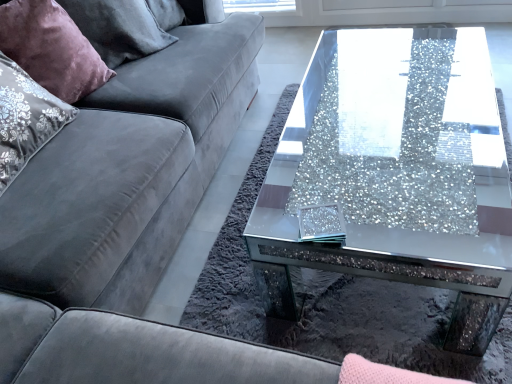
What are the coordinates of `velvet grey couch at left` in the screenshot? It's located at (129, 171).

What is the approximate height of sparkly glass coffee table at center?

sparkly glass coffee table at center is 15.68 inches tall.

Describe the element at coordinates (51, 48) in the screenshot. I see `velvet purple pillow at upper left` at that location.

What are the coordinates of `velvet grey couch at left` in the screenshot? It's located at (129, 171).

Visually, is velvet grey couch at left positioned to the left or to the right of velvet purple pillow at upper left?

From the image, it's evident that velvet grey couch at left is to the right of velvet purple pillow at upper left.

From a real-world perspective, which is physically below, velvet grey couch at left or velvet purple pillow at upper left?

velvet grey couch at left.

Considering the relative sizes of velvet grey couch at left and velvet purple pillow at upper left in the image provided, is velvet grey couch at left smaller than velvet purple pillow at upper left?

No, velvet grey couch at left is not smaller than velvet purple pillow at upper left.

Does velvet grey couch at left have a lesser width compared to velvet purple pillow at upper left?

Incorrect, the width of velvet grey couch at left is not less than that of velvet purple pillow at upper left.

Measure the distance from velvet grey couch at left to sparkly glass coffee table at center.

A distance of 21.33 inches exists between velvet grey couch at left and sparkly glass coffee table at center.

Which object is positioned more to the left, velvet grey couch at left or sparkly glass coffee table at center?

From the viewer's perspective, velvet grey couch at left appears more on the left side.

Is velvet grey couch at left further to the viewer compared to sparkly glass coffee table at center?

No, it is in front of sparkly glass coffee table at center.

Could you tell me if sparkly glass coffee table at center is turned towards velvet purple pillow at upper left?

No, sparkly glass coffee table at center does not turn towards velvet purple pillow at upper left.

In the image, is sparkly glass coffee table at center positioned in front of or behind velvet purple pillow at upper left?

sparkly glass coffee table at center is in front of velvet purple pillow at upper left.

How different are the orientations of sparkly glass coffee table at center and velvet purple pillow at upper left in degrees?

They differ by 27.7 degrees in their facing directions.

Is sparkly glass coffee table at center at the right side of velvet purple pillow at upper left?

Yes, sparkly glass coffee table at center is to the right of velvet purple pillow at upper left.

In the scene shown: Which of these two, velvet purple pillow at upper left or sparkly glass coffee table at center, is thinner?

velvet purple pillow at upper left.

Between point (60, 89) and point (429, 35), which one is positioned in front?

Point (60, 89)

From a real-world perspective, which is physically above, velvet purple pillow at upper left or sparkly glass coffee table at center?

velvet purple pillow at upper left.

Is sparkly glass coffee table at center inside velvet purple pillow at upper left?

No.

Is sparkly glass coffee table at center inside the boundaries of velvet grey couch at left, or outside?

sparkly glass coffee table at center is spatially situated outside velvet grey couch at left.

Considering the relative sizes of sparkly glass coffee table at center and velvet grey couch at left in the image provided, is sparkly glass coffee table at center bigger than velvet grey couch at left?

Incorrect, sparkly glass coffee table at center is not larger than velvet grey couch at left.

How distant is sparkly glass coffee table at center from velvet grey couch at left?

A distance of 54.18 centimeters exists between sparkly glass coffee table at center and velvet grey couch at left.

Between sparkly glass coffee table at center and velvet grey couch at left, which one has smaller width?

sparkly glass coffee table at center is thinner.

Which of these two, velvet purple pillow at upper left or velvet grey couch at left, is bigger?

Bigger between the two is velvet grey couch at left.

Find the location of a particular element. This screenshot has width=512, height=384. couch in front of the velvet purple pillow at upper left is located at coordinates (129, 171).

From the image's perspective, which is below, velvet purple pillow at upper left or velvet grey couch at left?

velvet grey couch at left appears lower in the image.

Is velvet purple pillow at upper left positioned before velvet grey couch at left?

No, the depth of velvet purple pillow at upper left is greater than that of velvet grey couch at left.

Identify the location of couch below the velvet purple pillow at upper left (from the image's perspective). (129, 171).

Image resolution: width=512 pixels, height=384 pixels. I want to click on couch that appears in front of the sparkly glass coffee table at center, so click(x=129, y=171).

Considering their positions, is sparkly glass coffee table at center positioned further to velvet purple pillow at upper left than velvet grey couch at left?

sparkly glass coffee table at center is positioned further to the anchor velvet purple pillow at upper left.

Which object lies nearer to the anchor point velvet grey couch at left, sparkly glass coffee table at center or velvet purple pillow at upper left?

Among the two, velvet purple pillow at upper left is located nearer to velvet grey couch at left.

Based on their spatial positions, is velvet grey couch at left or velvet purple pillow at upper left further from sparkly glass coffee table at center?

velvet purple pillow at upper left is further to sparkly glass coffee table at center.

When comparing their distances from velvet grey couch at left, does velvet purple pillow at upper left or sparkly glass coffee table at center seem closer?

velvet purple pillow at upper left.

Based on their spatial positions, is velvet purple pillow at upper left or velvet grey couch at left further from sparkly glass coffee table at center?

velvet purple pillow at upper left.

From the image, which object appears to be farther from velvet purple pillow at upper left, velvet grey couch at left or sparkly glass coffee table at center?

Based on the image, sparkly glass coffee table at center appears to be further to velvet purple pillow at upper left.

Identify the location of couch between velvet purple pillow at upper left and sparkly glass coffee table at center in the horizontal direction. (129, 171).